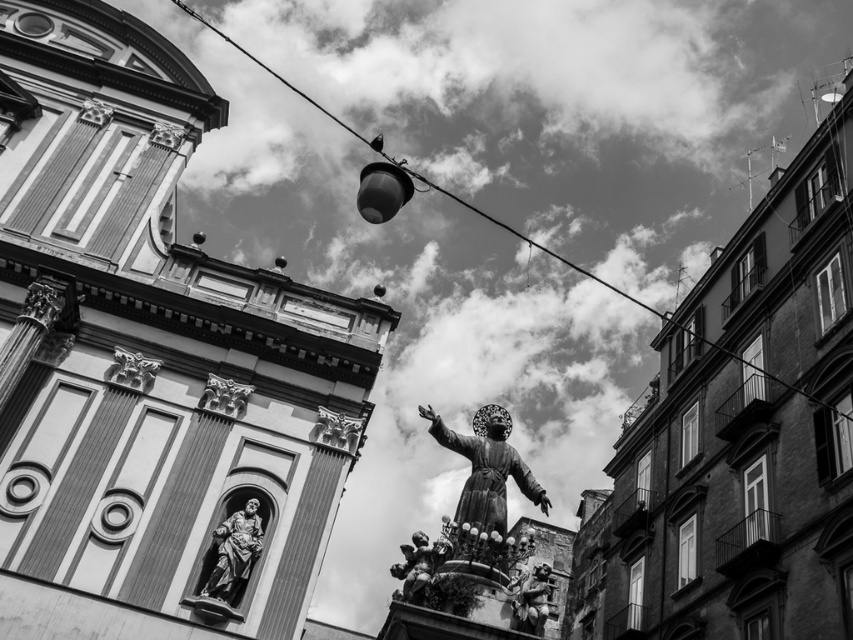
Question: Is polished bronze cherub at center above bronze statue at center?

Choices:
 (A) no
 (B) yes

Answer: (A)

Question: Which object is the farthest from the metallic wire at upper center?

Choices:
 (A) polished marble statue at center
 (B) polished stone eagle at upper left

Answer: (B)

Question: Observing the image, what is the correct spatial positioning of polished stone carving at center in reference to polished stone eagle at upper left?

Choices:
 (A) right
 (B) left

Answer: (A)

Question: Which object is the closest to the bronze statue at center?

Choices:
 (A) polished bronze statue at center
 (B) polished bronze statue at lower left

Answer: (A)

Question: Which point appears closest to the camera in this image?

Choices:
 (A) (535, 604)
 (B) (408, 566)
 (C) (485, 468)
 (D) (122, 353)

Answer: (A)

Question: In this image, where is polished marble statue at center located relative to polished bronze cherub at center?

Choices:
 (A) above
 (B) below

Answer: (A)